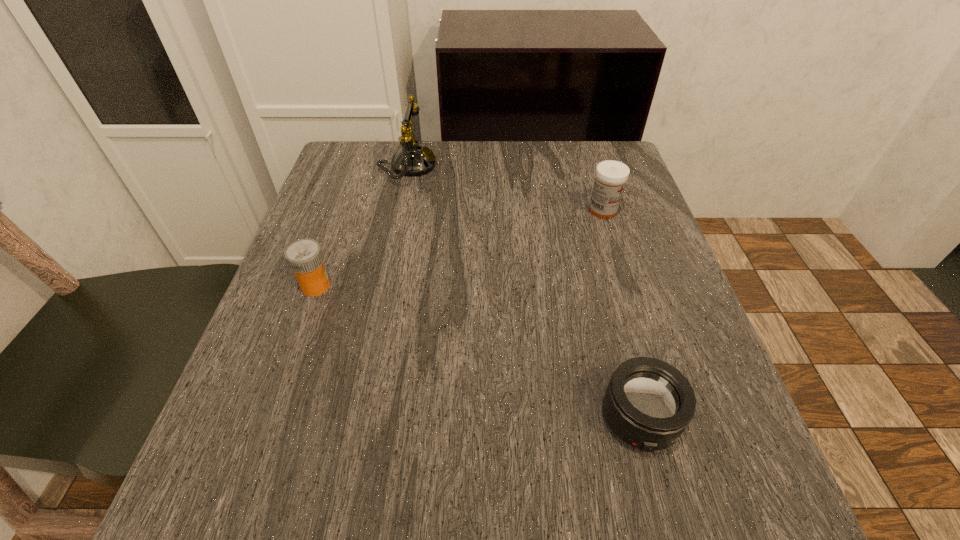
At what (x,y) coordinates should I click in order to perform the action: click on free space at the right edge. Please return your answer as a coordinate pair (x, y). The image size is (960, 540). Looking at the image, I should click on (633, 273).

The width and height of the screenshot is (960, 540). In the image, there is a desktop. What are the coordinates of `vacant space at the far left corner` in the screenshot? It's located at (354, 153).

Identify the location of vacant space at the near left corner. (240, 509).

Find the location of a particular element. The width and height of the screenshot is (960, 540). vacant space at the far right corner is located at coordinates (626, 190).

You are a GUI agent. You are given a task and a screenshot of the screen. Output one action in this format:
    pyautogui.click(x=<x>, y=<y>)
    Task: Click on the vacant area at the near right corner
    This screenshot has width=960, height=540.
    Given the screenshot: What is the action you would take?
    pyautogui.click(x=724, y=509)

Image resolution: width=960 pixels, height=540 pixels. Identify the location of vacant space in between the farther medicine and the nearest object. (621, 314).

This screenshot has width=960, height=540. What are the coordinates of `blank region between the second tallest object and the farthest object` in the screenshot? It's located at (505, 188).

Where is `vacant area that lies between the third shortest object and the leftmost object`? vacant area that lies between the third shortest object and the leftmost object is located at coordinates (460, 248).

Where is `empty space between the shorter medicine and the second farthest object`? This screenshot has width=960, height=540. empty space between the shorter medicine and the second farthest object is located at coordinates click(460, 248).

The image size is (960, 540). I want to click on free spot between the taller medicine and the tallest object, so click(x=505, y=188).